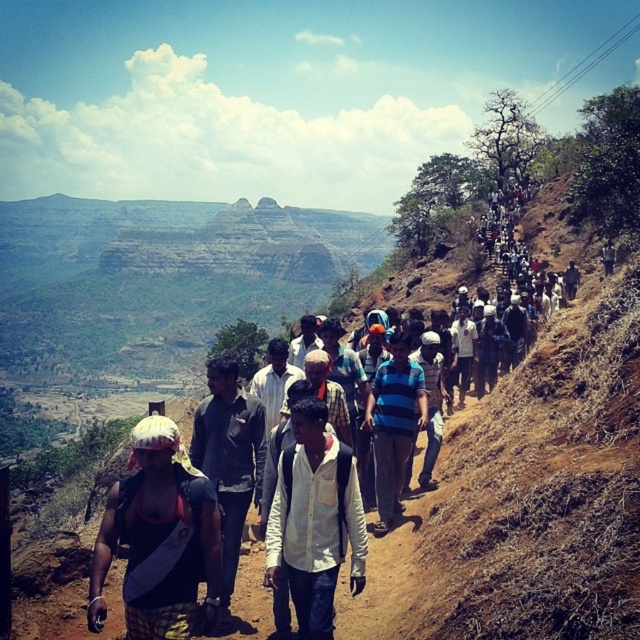
Question: Which of the following is the farthest from the observer?

Choices:
 (A) (193, 452)
 (B) (168, 602)

Answer: (A)

Question: Among these objects, which one is nearest to the camera?

Choices:
 (A) reddish-brown backpack at lower left
 (B) dark gray jacket at center
 (C) blue striped shirt at center
 (D) white matte shirt at center

Answer: (A)

Question: Is the position of reddish-brown backpack at lower left less distant than that of dark gray jacket at center?

Choices:
 (A) no
 (B) yes

Answer: (B)

Question: Can you confirm if white matte shirt at center is thinner than dark gray jacket at center?

Choices:
 (A) no
 (B) yes

Answer: (B)

Question: Can you confirm if white fabric shirt at center is positioned below blue striped shirt at center?

Choices:
 (A) yes
 (B) no

Answer: (B)

Question: Among these points, which one is nearest to the camera?

Choices:
 (A) (198, 564)
 (B) (380, 412)
 (C) (547, 193)
 (D) (272, 538)

Answer: (A)